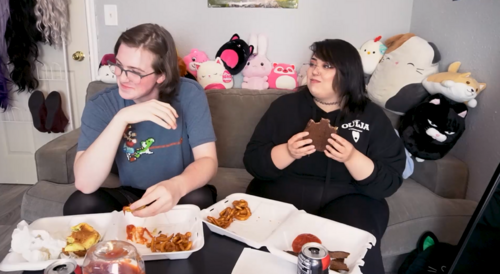
Locate an element on the screen. This screenshot has width=500, height=274. wall is located at coordinates (371, 28), (480, 50).